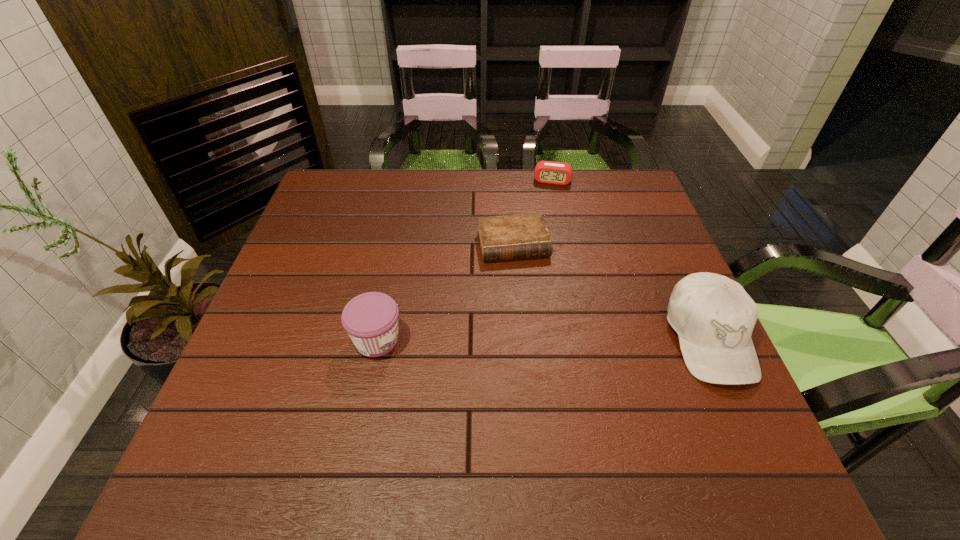
You are a GUI agent. You are given a task and a screenshot of the screen. Output one action in this format:
    pyautogui.click(x=<x>, y=<y>)
    Task: Click on the free space on the desktop that is between the second tallest object and the rightmost object and is positioned on the front-facing side of the farthest object
    This screenshot has width=960, height=540.
    Given the screenshot: What is the action you would take?
    pyautogui.click(x=528, y=339)

I want to click on free space on the desktop that is between the second tallest object and the baseball cap and is positioned on the spine side of the diary, so click(x=538, y=339).